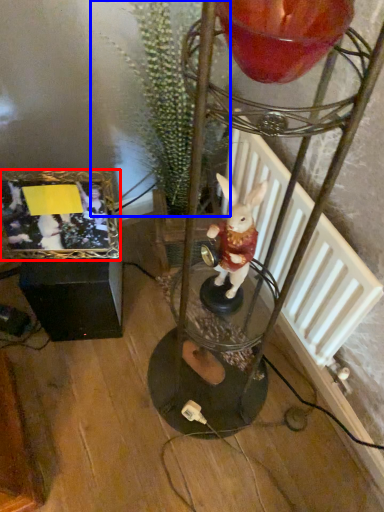
Question: Which object is closer to the camera taking this photo, picture frame (highlighted by a red box) or plant (highlighted by a blue box)?

Choices:
 (A) picture frame
 (B) plant

Answer: (B)